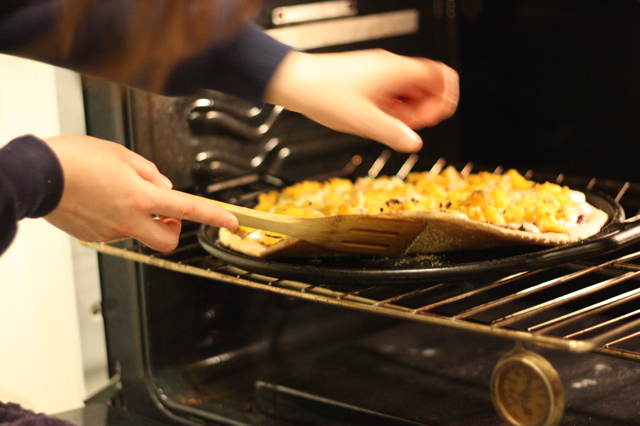
Image resolution: width=640 pixels, height=426 pixels. I want to click on wall side, so click(31, 77).